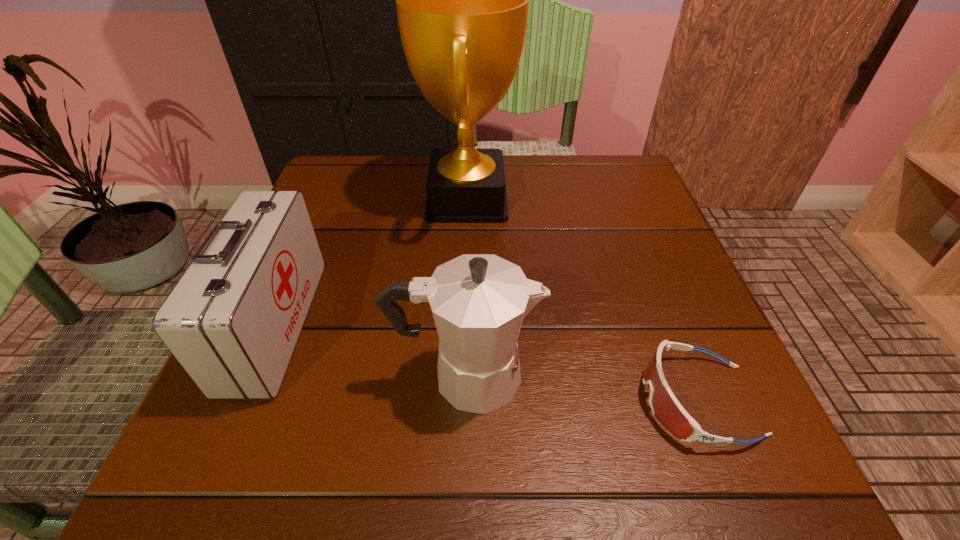
Find the location of `free space at the left edge of the desktop`. free space at the left edge of the desktop is located at coordinates (327, 379).

Locate an element on the screen. vacant region at the right edge of the desktop is located at coordinates (684, 379).

Identify the location of vacant space at the far left corner of the desktop. [x=369, y=181].

At what (x,y) coordinates should I click in order to perform the action: click on free space at the near left corner. Please return your answer as a coordinate pair (x, y). Image resolution: width=960 pixels, height=540 pixels. Looking at the image, I should click on (194, 484).

Find the location of a particular element. vacant space at the far right corner of the desktop is located at coordinates (593, 157).

Find the location of a particular element. The width and height of the screenshot is (960, 540). empty space between the tallest object and the rightmost object is located at coordinates (583, 300).

I want to click on unoccupied area between the goggles and the farthest object, so click(x=583, y=300).

Image resolution: width=960 pixels, height=540 pixels. What are the coordinates of `free spot between the rightmost object and the award` in the screenshot? It's located at (583, 300).

Find the location of a particular element. The width and height of the screenshot is (960, 540). vacant space that is in between the third tallest object and the third shortest object is located at coordinates (371, 350).

Locate an element on the screen. The image size is (960, 540). vacant area between the third shortest object and the shortest object is located at coordinates (582, 388).